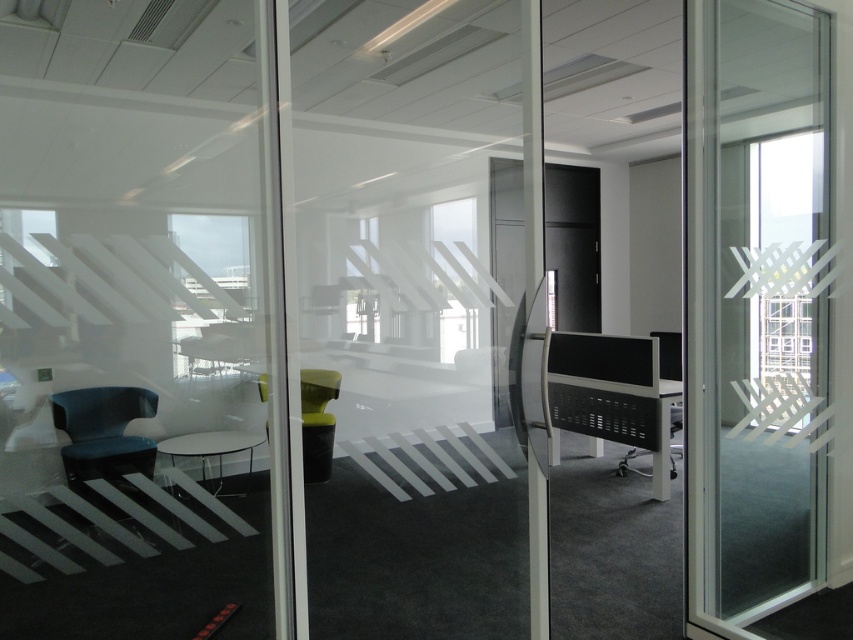
Question: Which of the following is the closest to the observer?

Choices:
 (A) matte blue chair at lower left
 (B) green fabric chair at center
 (C) transparent glass screen door at right

Answer: (C)

Question: In this image, where is matte blue chair at lower left located relative to matte black chair at right?

Choices:
 (A) above
 (B) below

Answer: (A)

Question: Can you confirm if transparent glass screen door at right is positioned to the left of green fabric chair at center?

Choices:
 (A) yes
 (B) no

Answer: (B)

Question: Which point appears farthest from the camera in this image?

Choices:
 (A) (326, 413)
 (B) (99, 412)
 (C) (703, 460)
 (D) (624, 467)

Answer: (A)

Question: Is green fabric chair at center smaller than matte black chair at right?

Choices:
 (A) no
 (B) yes

Answer: (A)

Question: Which point is closer to the camera?

Choices:
 (A) pos(312,460)
 (B) pos(140,410)
 (C) pos(669,368)

Answer: (B)